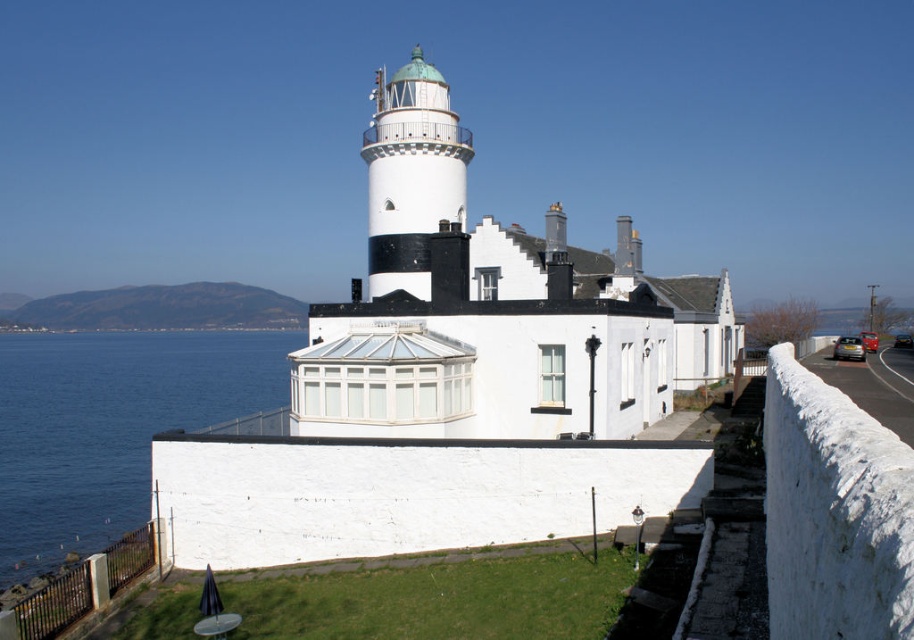
Is blue water at lower left closer to camera compared to white painted metal lighthouse at center?

That is False.

Can you confirm if blue water at lower left is thinner than white painted metal lighthouse at center?

No.

This screenshot has width=914, height=640. Describe the element at coordinates (110, 426) in the screenshot. I see `blue water at lower left` at that location.

You are a GUI agent. You are given a task and a screenshot of the screen. Output one action in this format:
    pyautogui.click(x=<x>, y=<y>)
    Task: Click on the blue water at lower left
    Image resolution: width=914 pixels, height=640 pixels.
    Given the screenshot: What is the action you would take?
    pyautogui.click(x=110, y=426)